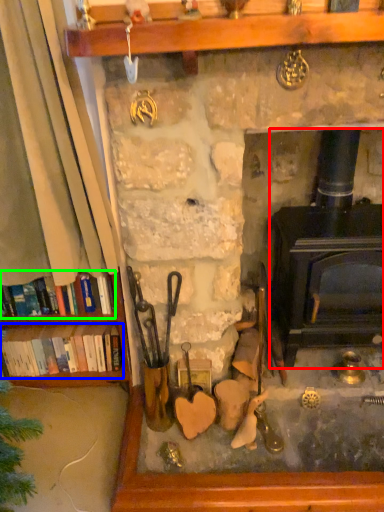
Question: Which object is positioned closest to wood burning stove (highlighted by a red box)? Select from book (highlighted by a blue box) and book (highlighted by a green box).

Choices:
 (A) book
 (B) book

Answer: (B)